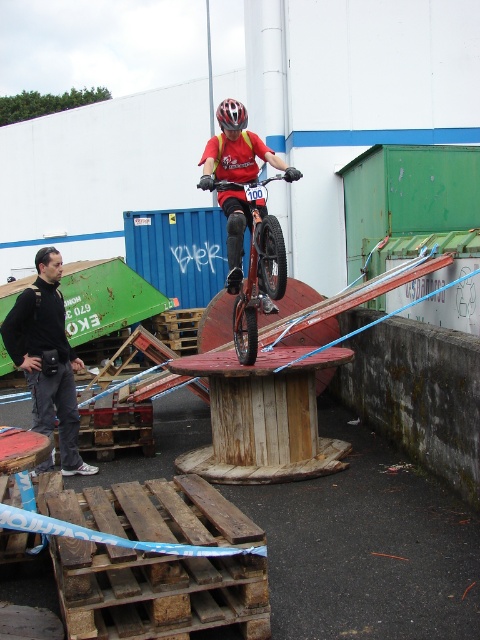
You are a stunt coordinator planning a safety zone around the orange matte mountain bike at center. The safety zone must be a circle with a radius of 2 meters. Will the black fabric camera at left be inside this safety zone?

The distance between the black fabric camera at left and the orange matte mountain bike at center is 1.87 meters, which is less than the 2 meters radius of the safety zone. Therefore, the black fabric camera at left is inside the safety zone.

You are a photographer trying to capture a clear shot of the orange matte mountain bike at center and the black matte bicycle helmet at upper center. Which object should you focus on first if you want to ensure both are in focus without adjusting the camera settings?

The orange matte mountain bike at center is taller than the black matte bicycle helmet at upper center, so focusing on the taller object first would help maintain focus on both.

You are a photographer trying to capture the stunt rider on the orange matte mountain bike at center. You have a black fabric camera at left. To get a clear shot, you need to position yourself so that the camera is above the bike. Is your current position with the camera below the bike an issue?

The black fabric camera at left is below the orange matte mountain bike at center, so the current position would make it difficult to get a clear shot from above. You should adjust your position to raise the camera above the bike.